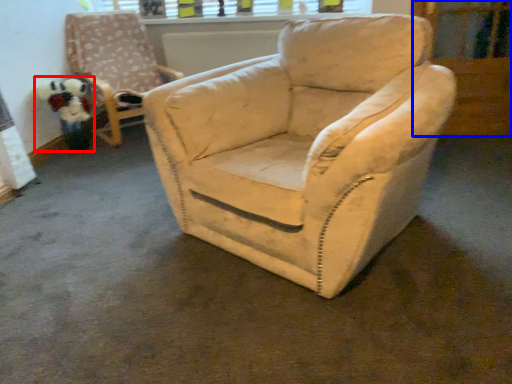
Question: Which of the following is the closest to the observer, toy (highlighted by a red box) or screen door (highlighted by a blue box)?

Choices:
 (A) toy
 (B) screen door

Answer: (B)